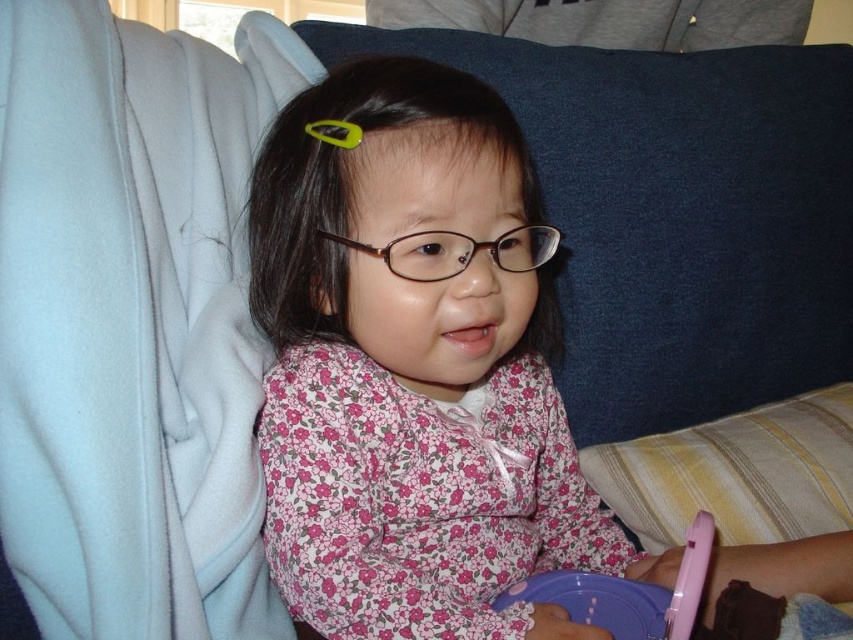
Measure the distance between pink floral dress at center and chocolate cake at lower right.

pink floral dress at center is 26.22 centimeters away from chocolate cake at lower right.

Is pink floral dress at center taller than chocolate cake at lower right?

Yes.

Is point (553, 472) less distant than point (761, 604)?

No.

At what (x,y) coordinates should I click in order to perform the action: click on pink floral dress at center. Please return your answer as a coordinate pair (x, y). Looking at the image, I should click on (415, 364).

Who is shorter, purple plastic paper plate at lower center or chocolate cake at lower right?

Standing shorter between the two is chocolate cake at lower right.

Can you confirm if purple plastic paper plate at lower center is shorter than chocolate cake at lower right?

No, purple plastic paper plate at lower center is not shorter than chocolate cake at lower right.

Is point (616, 596) more distant than point (782, 609)?

Yes.

This screenshot has height=640, width=853. In order to click on purple plastic paper plate at lower center in this screenshot , I will do `click(601, 602)`.

Can you confirm if pink floral dress at center is positioned to the left of purple plastic paper plate at lower center?

Correct, you'll find pink floral dress at center to the left of purple plastic paper plate at lower center.

This screenshot has width=853, height=640. Describe the element at coordinates (415, 364) in the screenshot. I see `pink floral dress at center` at that location.

Where is `pink floral dress at center`? Image resolution: width=853 pixels, height=640 pixels. pink floral dress at center is located at coordinates (415, 364).